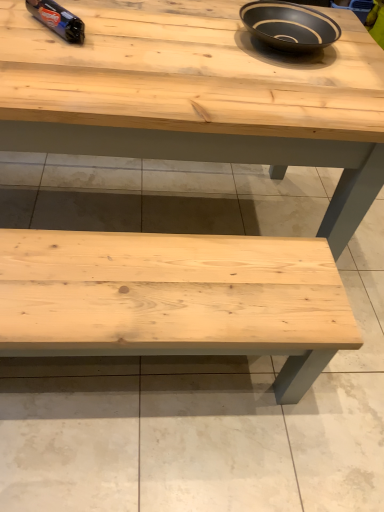
Question: Could you tell me if natural wood bench at bottom is facing natural wood table at center?

Choices:
 (A) yes
 (B) no

Answer: (B)

Question: Is natural wood bench at bottom positioned in front of natural wood table at center?

Choices:
 (A) no
 (B) yes

Answer: (A)

Question: Is natural wood bench at bottom placed right next to natural wood table at center?

Choices:
 (A) yes
 (B) no

Answer: (B)

Question: Does natural wood bench at bottom contain natural wood table at center?

Choices:
 (A) no
 (B) yes

Answer: (A)

Question: Does natural wood bench at bottom have a lesser width compared to natural wood table at center?

Choices:
 (A) no
 (B) yes

Answer: (A)

Question: Is natural wood bench at bottom to the right of natural wood table at center from the viewer's perspective?

Choices:
 (A) no
 (B) yes

Answer: (B)

Question: From a real-world perspective, is natural wood bench at bottom physically below black matte bowl at upper center?

Choices:
 (A) no
 (B) yes

Answer: (B)

Question: From the image's perspective, is natural wood bench at bottom under black matte bowl at upper center?

Choices:
 (A) no
 (B) yes

Answer: (B)

Question: Is natural wood bench at bottom oriented towards black matte bowl at upper center?

Choices:
 (A) no
 (B) yes

Answer: (A)

Question: Considering the relative sizes of natural wood bench at bottom and black matte bowl at upper center in the image provided, is natural wood bench at bottom thinner than black matte bowl at upper center?

Choices:
 (A) no
 (B) yes

Answer: (A)

Question: Considering the relative sizes of natural wood bench at bottom and black matte bowl at upper center in the image provided, is natural wood bench at bottom shorter than black matte bowl at upper center?

Choices:
 (A) no
 (B) yes

Answer: (B)

Question: Is natural wood bench at bottom with black matte bowl at upper center?

Choices:
 (A) yes
 (B) no

Answer: (B)

Question: Is shiny blue plastic bottle at upper left far from natural wood bench at bottom?

Choices:
 (A) no
 (B) yes

Answer: (B)